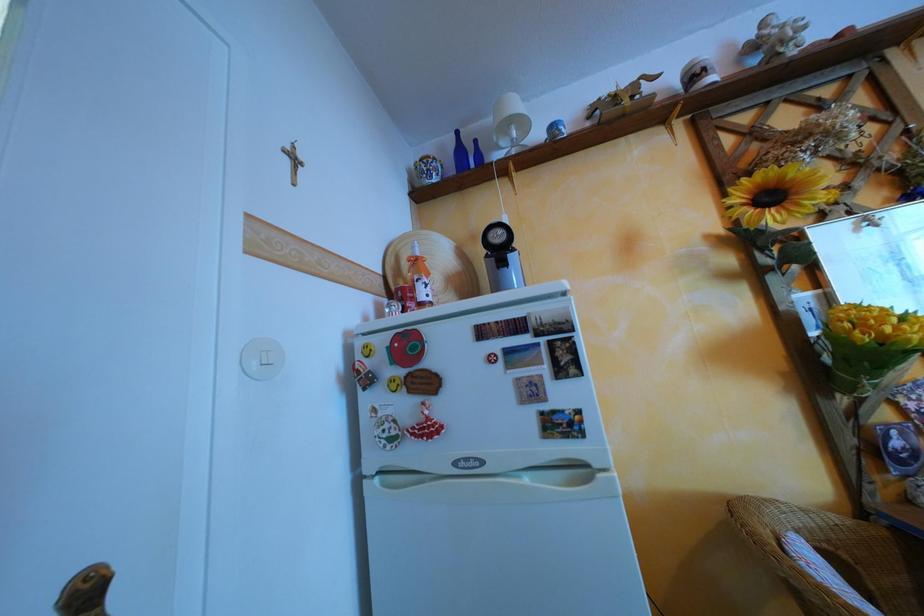
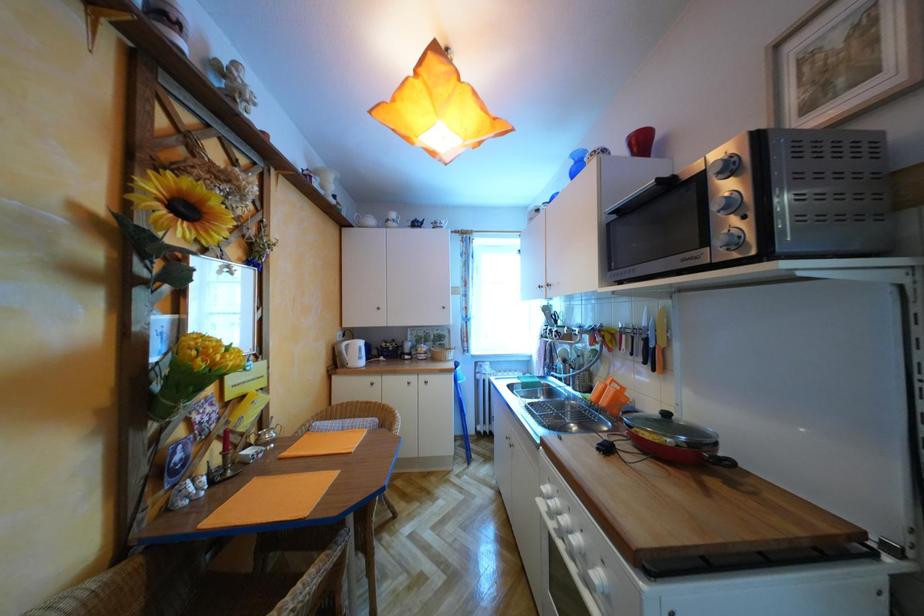
Question: The first image is from the beginning of the video and the second image is from the end. How did the camera likely rotate when shooting the video?

Choices:
 (A) Left
 (B) Right
 (C) Up
 (D) Down

Answer: (B)